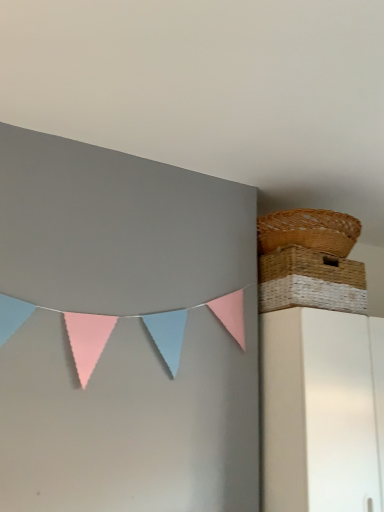
I want to click on woven brown picnic basket at upper right, arranged as the 2th picnic basket when ordered from the bottom, so 308,231.

What is the approximate height of woven brown picnic basket at upper right, acting as the first picnic basket starting from the top?

The height of woven brown picnic basket at upper right, acting as the first picnic basket starting from the top, is 5.63 inches.

Describe the element at coordinates (308, 231) in the screenshot. I see `woven brown picnic basket at upper right, acting as the first picnic basket starting from the top` at that location.

Image resolution: width=384 pixels, height=512 pixels. In order to click on woven straw picnic basket at upper right, placed as the 2th picnic basket when sorted from top to bottom in this screenshot , I will do `click(310, 281)`.

Describe the element at coordinates (310, 281) in the screenshot. I see `woven straw picnic basket at upper right, the first picnic basket positioned from the bottom` at that location.

The image size is (384, 512). Find the location of `woven brown picnic basket at upper right, acting as the first picnic basket starting from the top`. woven brown picnic basket at upper right, acting as the first picnic basket starting from the top is located at coordinates (308, 231).

Which object is positioned more to the left, woven brown picnic basket at upper right, acting as the first picnic basket starting from the top, or woven straw picnic basket at upper right, placed as the 2th picnic basket when sorted from top to bottom?

woven straw picnic basket at upper right, placed as the 2th picnic basket when sorted from top to bottom.

Which object is more forward, woven brown picnic basket at upper right, acting as the first picnic basket starting from the top, or woven straw picnic basket at upper right, placed as the 2th picnic basket when sorted from top to bottom?

woven straw picnic basket at upper right, placed as the 2th picnic basket when sorted from top to bottom.

Does point (304, 219) come in front of point (313, 285)?

No, it is behind (313, 285).

From the image's perspective, relative to woven straw picnic basket at upper right, the first picnic basket positioned from the bottom, is woven brown picnic basket at upper right, arranged as the 2th picnic basket when ordered from the bottom, above or below?

From the image's perspective, woven brown picnic basket at upper right, arranged as the 2th picnic basket when ordered from the bottom, appears above woven straw picnic basket at upper right, the first picnic basket positioned from the bottom.

From a real-world perspective, is woven brown picnic basket at upper right, arranged as the 2th picnic basket when ordered from the bottom, over woven straw picnic basket at upper right, placed as the 2th picnic basket when sorted from top to bottom?

Yes, from a real-world perspective, woven brown picnic basket at upper right, arranged as the 2th picnic basket when ordered from the bottom, is over woven straw picnic basket at upper right, placed as the 2th picnic basket when sorted from top to bottom

Between woven brown picnic basket at upper right, arranged as the 2th picnic basket when ordered from the bottom, and woven straw picnic basket at upper right, placed as the 2th picnic basket when sorted from top to bottom, which one has smaller width?

Thinner between the two is woven straw picnic basket at upper right, placed as the 2th picnic basket when sorted from top to bottom.

Does woven brown picnic basket at upper right, acting as the first picnic basket starting from the top, have a lesser height compared to woven straw picnic basket at upper right, placed as the 2th picnic basket when sorted from top to bottom?

Yes.

Can you confirm if woven brown picnic basket at upper right, acting as the first picnic basket starting from the top, is smaller than woven straw picnic basket at upper right, placed as the 2th picnic basket when sorted from top to bottom?

Yes.

Is woven straw picnic basket at upper right, placed as the 2th picnic basket when sorted from top to bottom, located within woven brown picnic basket at upper right, acting as the first picnic basket starting from the top?

No, woven brown picnic basket at upper right, acting as the first picnic basket starting from the top, does not contain woven straw picnic basket at upper right, placed as the 2th picnic basket when sorted from top to bottom.

Is woven brown picnic basket at upper right, arranged as the 2th picnic basket when ordered from the bottom, far from woven straw picnic basket at upper right, the first picnic basket positioned from the bottom?

woven brown picnic basket at upper right, arranged as the 2th picnic basket when ordered from the bottom, is near woven straw picnic basket at upper right, the first picnic basket positioned from the bottom, not far away.

Is woven brown picnic basket at upper right, arranged as the 2th picnic basket when ordered from the bottom, facing towards woven straw picnic basket at upper right, the first picnic basket positioned from the bottom?

No, woven brown picnic basket at upper right, arranged as the 2th picnic basket when ordered from the bottom, is not oriented towards woven straw picnic basket at upper right, the first picnic basket positioned from the bottom.

What's the angular difference between woven brown picnic basket at upper right, acting as the first picnic basket starting from the top, and woven straw picnic basket at upper right, placed as the 2th picnic basket when sorted from top to bottom,'s facing directions?

The angular difference between woven brown picnic basket at upper right, acting as the first picnic basket starting from the top, and woven straw picnic basket at upper right, placed as the 2th picnic basket when sorted from top to bottom, is 0.000217 degrees.

Locate an element on the screen. The height and width of the screenshot is (512, 384). picnic basket on the right side of woven straw picnic basket at upper right, the first picnic basket positioned from the bottom is located at coordinates (308, 231).

Considering the relative positions of woven straw picnic basket at upper right, the first picnic basket positioned from the bottom, and woven brown picnic basket at upper right, acting as the first picnic basket starting from the top, in the image provided, is woven straw picnic basket at upper right, the first picnic basket positioned from the bottom, to the left of woven brown picnic basket at upper right, acting as the first picnic basket starting from the top, from the viewer's perspective?

Yes, woven straw picnic basket at upper right, the first picnic basket positioned from the bottom, is to the left of woven brown picnic basket at upper right, acting as the first picnic basket starting from the top.

Does woven straw picnic basket at upper right, the first picnic basket positioned from the bottom, lie behind woven brown picnic basket at upper right, acting as the first picnic basket starting from the top?

No, woven straw picnic basket at upper right, the first picnic basket positioned from the bottom, is closer to the camera.

Which point is more forward, [350,273] or [324,233]?

Point [324,233]

From the image's perspective, between woven straw picnic basket at upper right, the first picnic basket positioned from the bottom, and woven brown picnic basket at upper right, arranged as the 2th picnic basket when ordered from the bottom, who is located below?

woven straw picnic basket at upper right, the first picnic basket positioned from the bottom.

From a real-world perspective, which is physically above, woven straw picnic basket at upper right, the first picnic basket positioned from the bottom, or woven brown picnic basket at upper right, arranged as the 2th picnic basket when ordered from the bottom?

woven brown picnic basket at upper right, arranged as the 2th picnic basket when ordered from the bottom.

Considering the relative sizes of woven straw picnic basket at upper right, the first picnic basket positioned from the bottom, and woven brown picnic basket at upper right, acting as the first picnic basket starting from the top, in the image provided, is woven straw picnic basket at upper right, the first picnic basket positioned from the bottom, thinner than woven brown picnic basket at upper right, acting as the first picnic basket starting from the top,?

Indeed, woven straw picnic basket at upper right, the first picnic basket positioned from the bottom, has a lesser width compared to woven brown picnic basket at upper right, acting as the first picnic basket starting from the top.

Considering the relative sizes of woven straw picnic basket at upper right, placed as the 2th picnic basket when sorted from top to bottom, and woven brown picnic basket at upper right, acting as the first picnic basket starting from the top, in the image provided, is woven straw picnic basket at upper right, placed as the 2th picnic basket when sorted from top to bottom, taller than woven brown picnic basket at upper right, acting as the first picnic basket starting from the top,?

Yes.

Which of these two, woven straw picnic basket at upper right, the first picnic basket positioned from the bottom, or woven brown picnic basket at upper right, arranged as the 2th picnic basket when ordered from the bottom, is smaller?

woven brown picnic basket at upper right, arranged as the 2th picnic basket when ordered from the bottom, is smaller.

Is woven brown picnic basket at upper right, arranged as the 2th picnic basket when ordered from the bottom, located within woven straw picnic basket at upper right, placed as the 2th picnic basket when sorted from top to bottom?

No, woven brown picnic basket at upper right, arranged as the 2th picnic basket when ordered from the bottom, is not surrounded by woven straw picnic basket at upper right, placed as the 2th picnic basket when sorted from top to bottom.

Is woven straw picnic basket at upper right, placed as the 2th picnic basket when sorted from top to bottom, not close to woven brown picnic basket at upper right, acting as the first picnic basket starting from the top?

No.

Is woven straw picnic basket at upper right, placed as the 2th picnic basket when sorted from top to bottom, facing away from woven brown picnic basket at upper right, acting as the first picnic basket starting from the top?

That's not correct — woven straw picnic basket at upper right, placed as the 2th picnic basket when sorted from top to bottom, is not looking away from woven brown picnic basket at upper right, acting as the first picnic basket starting from the top.

What's the angular difference between woven straw picnic basket at upper right, placed as the 2th picnic basket when sorted from top to bottom, and woven brown picnic basket at upper right, acting as the first picnic basket starting from the top,'s facing directions?

There is a 0.000217-degree angle between the facing directions of woven straw picnic basket at upper right, placed as the 2th picnic basket when sorted from top to bottom, and woven brown picnic basket at upper right, acting as the first picnic basket starting from the top.

In the scene shown: Measure the distance between woven straw picnic basket at upper right, the first picnic basket positioned from the bottom, and woven brown picnic basket at upper right, acting as the first picnic basket starting from the top.

The distance of woven straw picnic basket at upper right, the first picnic basket positioned from the bottom, from woven brown picnic basket at upper right, acting as the first picnic basket starting from the top, is 10.41 centimeters.

The width and height of the screenshot is (384, 512). Find the location of `picnic basket on the left of woven brown picnic basket at upper right, acting as the first picnic basket starting from the top`. picnic basket on the left of woven brown picnic basket at upper right, acting as the first picnic basket starting from the top is located at coordinates (310, 281).

In order to click on picnic basket on the left of woven brown picnic basket at upper right, acting as the first picnic basket starting from the top in this screenshot , I will do `click(310, 281)`.

The height and width of the screenshot is (512, 384). In order to click on picnic basket in front of the woven brown picnic basket at upper right, arranged as the 2th picnic basket when ordered from the bottom in this screenshot , I will do `click(310, 281)`.